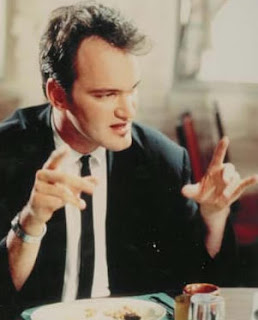
I want to click on plate, so click(x=91, y=299).